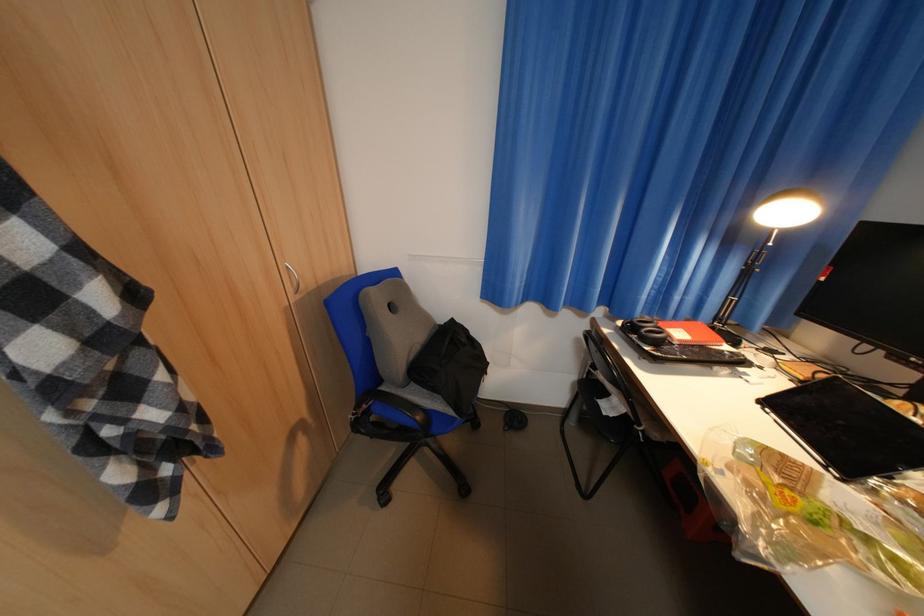
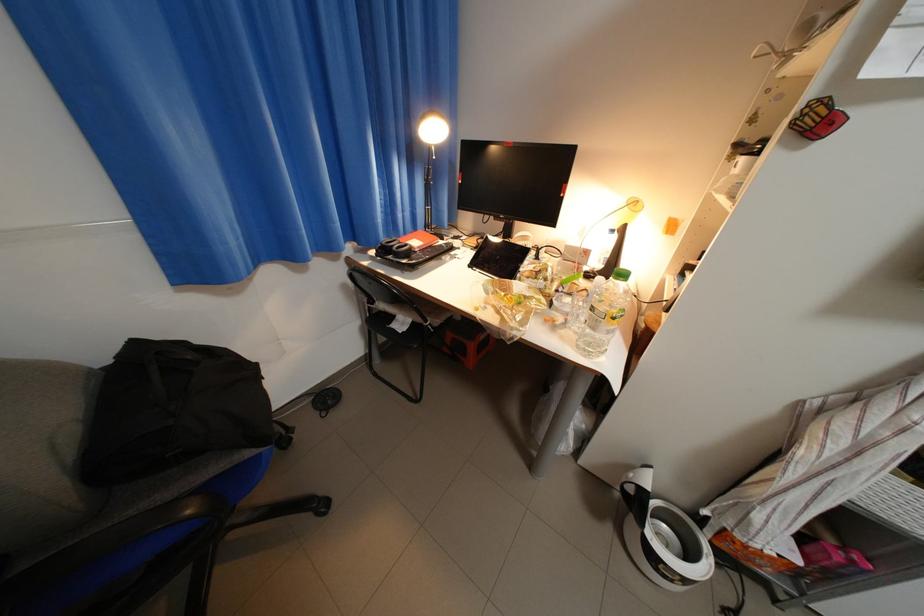
Where in the second image is the point corresponding to pixel 641 330 from the first image?

(395, 253)